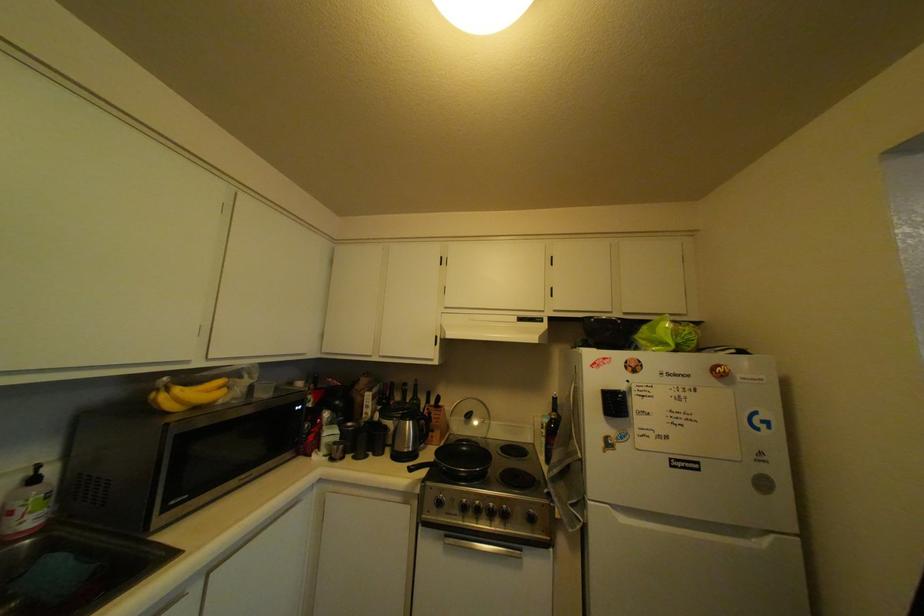
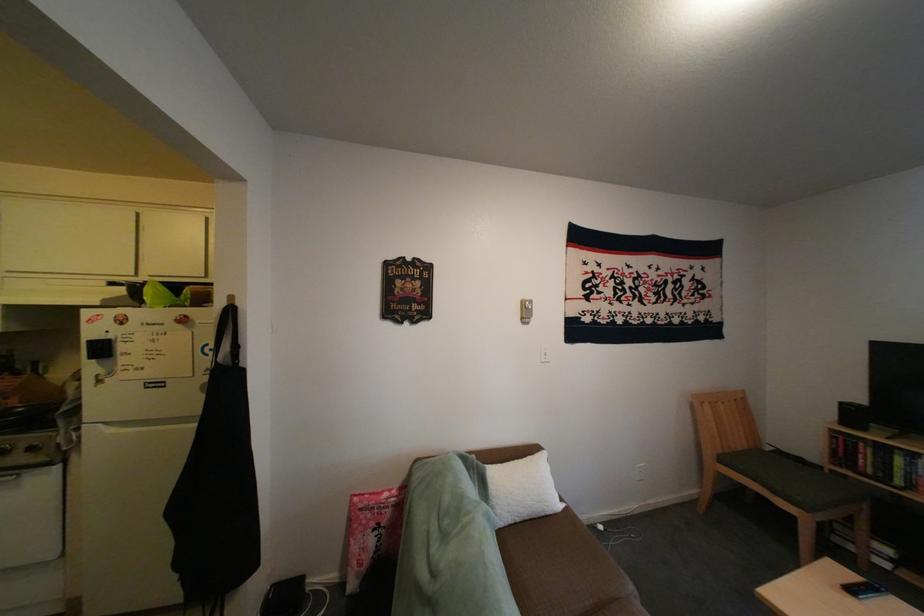
In a continuous first-person perspective shot, in which direction is the camera moving?

The cameraman walked toward right, backward.